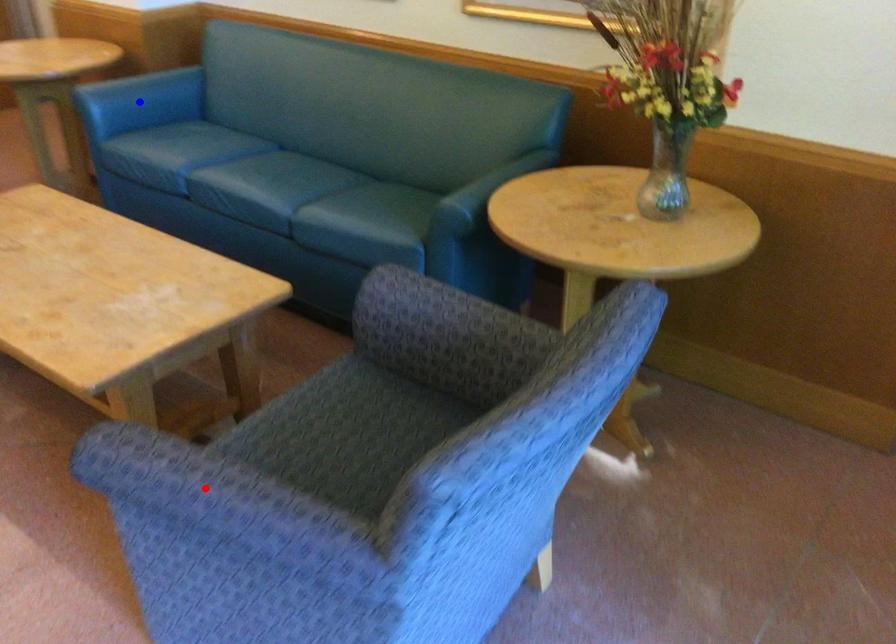
Question: In the image, two points are highlighted. Which point is nearer to the camera? Reply with the corresponding letter.

Choices:
 (A) blue point
 (B) red point

Answer: (B)